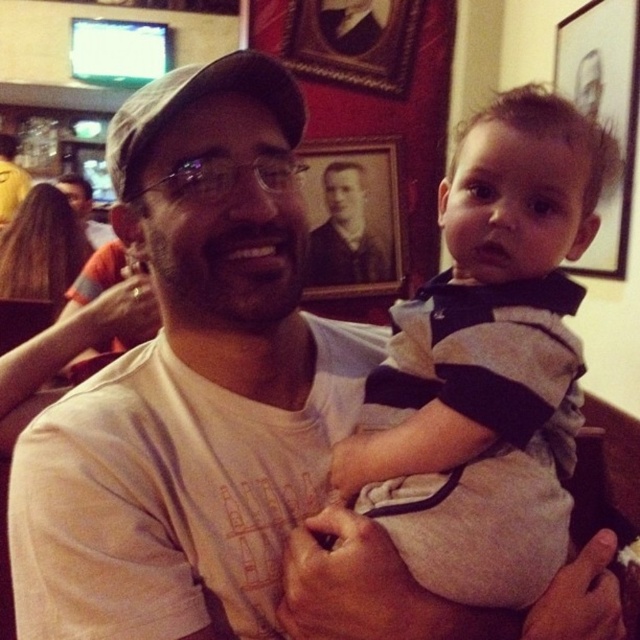
Question: Which object is the farthest from the black matte picture frame at upper right?

Choices:
 (A) matte white shirt at center
 (B) striped cotton shirt at center
 (C) black matte picture frame at upper center

Answer: (A)

Question: Does striped cotton shirt at center have a smaller size compared to black matte picture frame at upper right?

Choices:
 (A) yes
 (B) no

Answer: (A)

Question: Can you confirm if black matte picture frame at upper center is wider than matte white shirt at center?

Choices:
 (A) no
 (B) yes

Answer: (A)

Question: Which object is positioned farthest from the striped cotton shirt at center?

Choices:
 (A) black matte picture frame at upper right
 (B) black matte picture frame at upper center
 (C) matte white shirt at center

Answer: (C)

Question: Which of the following is the closest to the observer?

Choices:
 (A) (92, 228)
 (B) (429, 442)
 (C) (339, 241)

Answer: (B)

Question: Is striped cotton shirt at center wider than black matte picture frame at upper right?

Choices:
 (A) yes
 (B) no

Answer: (A)